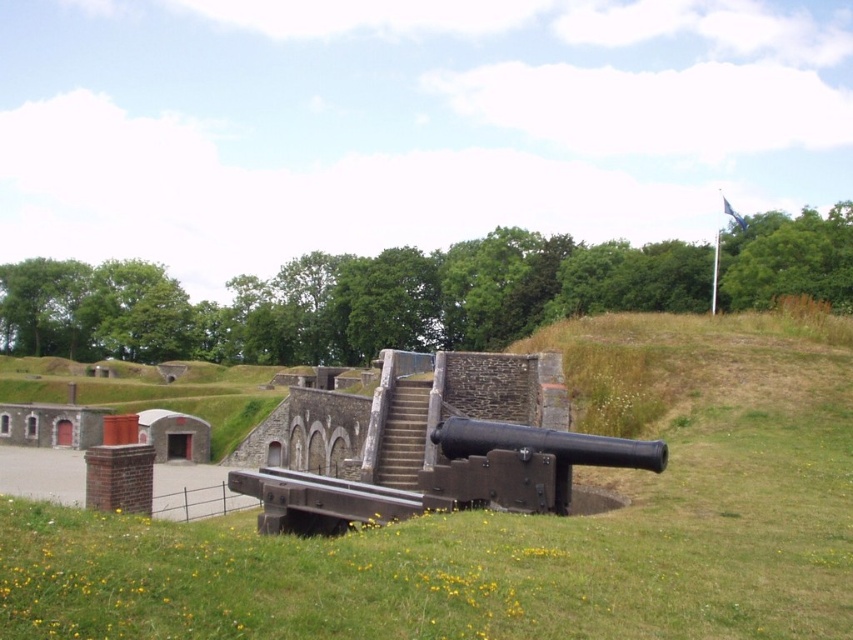
Question: Observing the image, what is the correct spatial positioning of green grassy at center in reference to black matte cannon at center?

Choices:
 (A) right
 (B) left

Answer: (A)

Question: Among these objects, which one is farthest from the camera?

Choices:
 (A) green grassy at center
 (B) black matte cannon at center

Answer: (B)

Question: Is green grassy at center below black matte cannon at center?

Choices:
 (A) yes
 (B) no

Answer: (A)

Question: Which object is farther from the camera taking this photo?

Choices:
 (A) green grassy at center
 (B) black matte cannon at center

Answer: (B)

Question: Can you confirm if green grassy at center is positioned to the left of black matte cannon at center?

Choices:
 (A) yes
 (B) no

Answer: (B)